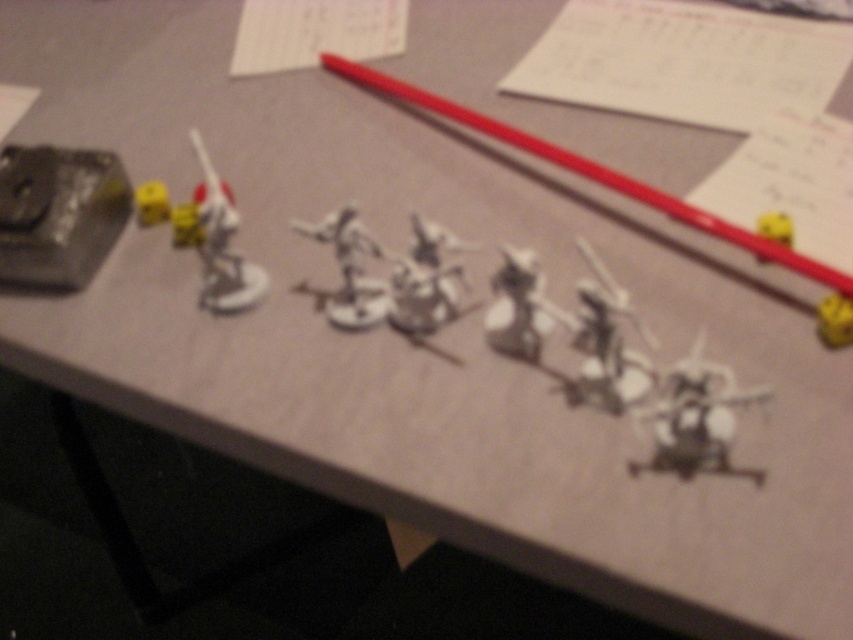
Which is in front, point (529, 326) or point (851, 307)?

Point (851, 307) is in front.

Which is behind, point (492, 342) or point (840, 342)?

The point (492, 342) is behind.

You are a GUI agent. You are given a task and a screenshot of the screen. Output one action in this format:
    pyautogui.click(x=<x>, y=<y>)
    Task: Click on the satin silver figure at center
    The image size is (853, 640).
    Given the screenshot: What is the action you would take?
    pyautogui.click(x=520, y=307)

Is yellow matte dice at center closer to the viewer compared to yellow matte toy at upper right?

That is True.

What do you see at coordinates (834, 320) in the screenshot? Image resolution: width=853 pixels, height=640 pixels. I see `yellow matte dice at center` at bounding box center [834, 320].

Is point (827, 337) positioned before point (755, 256)?

That is True.

Find the location of a particular element. The width and height of the screenshot is (853, 640). yellow matte dice at center is located at coordinates (834, 320).

Looking at this image, is satin silver figure at upper left shorter than white plastic toy at center?

No, satin silver figure at upper left is not shorter than white plastic toy at center.

Does satin silver figure at upper left lie behind white plastic toy at center?

Yes, it is.

This screenshot has height=640, width=853. What do you see at coordinates (219, 241) in the screenshot? I see `satin silver figure at upper left` at bounding box center [219, 241].

The image size is (853, 640). Find the location of `satin silver figure at upper left`. satin silver figure at upper left is located at coordinates (219, 241).